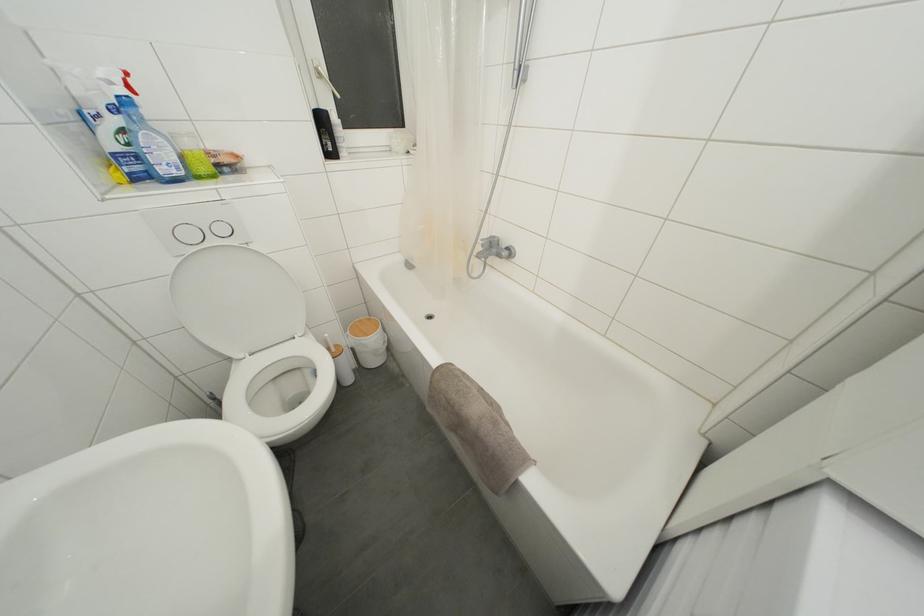
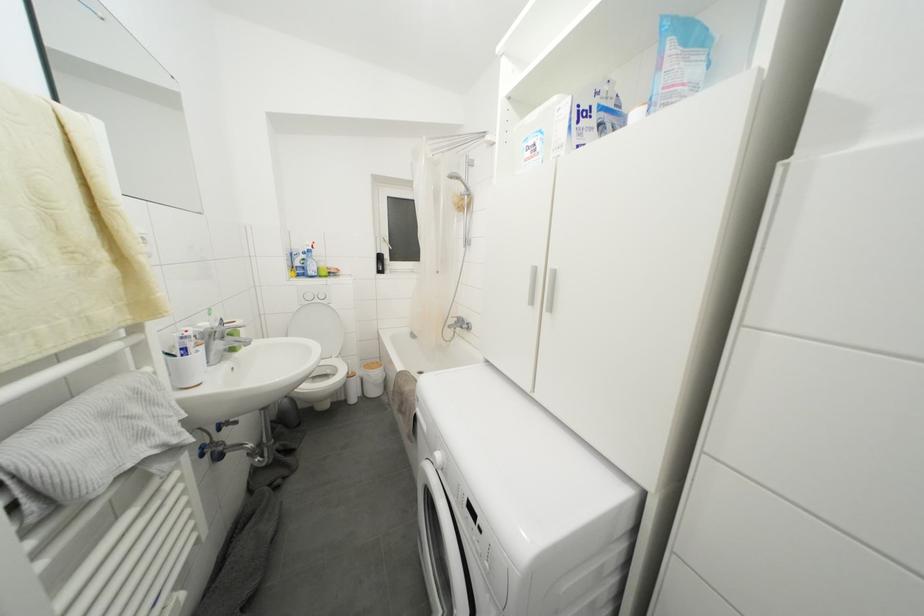
Question: The first image is from the beginning of the video and the second image is from the end. How did the camera likely rotate when shooting the video?

Choices:
 (A) Left
 (B) Right
 (C) Up
 (D) Down

Answer: (C)